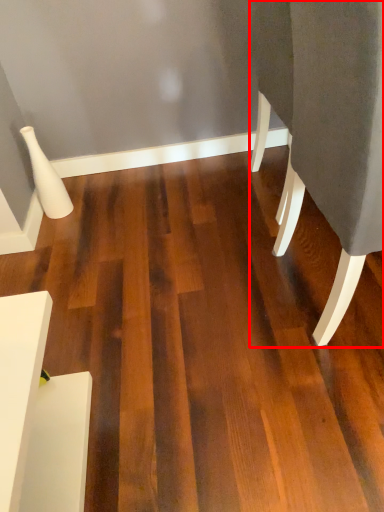
Question: Considering the relative positions of furniture (annotated by the red box) and furniture in the image provided, where is furniture (annotated by the red box) located with respect to the staircase?

Choices:
 (A) right
 (B) left

Answer: (A)